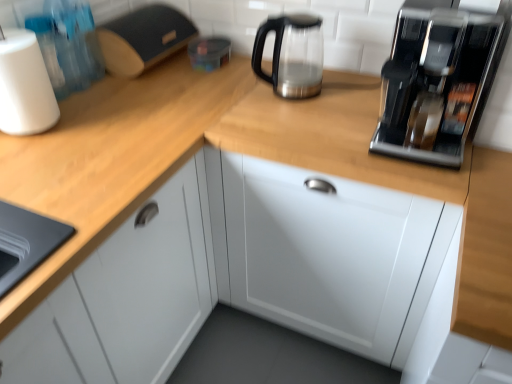
Image resolution: width=512 pixels, height=384 pixels. I want to click on matte black bread bin at upper left, so click(x=143, y=38).

This screenshot has width=512, height=384. I want to click on wooden at left, so click(x=110, y=159).

This screenshot has width=512, height=384. I want to click on white glossy cabinet at center, so click(336, 258).

In order to face white matte paper towel at left, should I rotate leftwards or rightwards?

Turn left by 29.865 degrees to look at white matte paper towel at left.

The width and height of the screenshot is (512, 384). In order to click on sleek metallic coffee machine at upper right in this screenshot , I will do click(438, 79).

From a real-world perspective, who is located higher, satin metallic kettle at upper center or matte black bread bin at upper left?

From a 3D spatial view, satin metallic kettle at upper center is above.

How many degrees apart are the facing directions of satin metallic kettle at upper center and matte black bread bin at upper left?

There is a 88.2-degree angle between the facing directions of satin metallic kettle at upper center and matte black bread bin at upper left.

Is satin metallic kettle at upper center facing away from matte black bread bin at upper left?

satin metallic kettle at upper center does not have its back to matte black bread bin at upper left.

Looking at this image, is satin metallic kettle at upper center not within matte black bread bin at upper left?

Yes, satin metallic kettle at upper center is outside of matte black bread bin at upper left.

Identify the location of kitchen appliance behind the white glossy cabinet at center. (292, 55).

Is satin metallic kettle at upper center at the right side of white glossy cabinet at center?

No.

Does satin metallic kettle at upper center have a lesser width compared to white glossy cabinet at center?

Yes, satin metallic kettle at upper center is thinner than white glossy cabinet at center.

Is satin metallic kettle at upper center located outside white glossy cabinet at center?

That's correct, satin metallic kettle at upper center is outside of white glossy cabinet at center.

From the image's perspective, between satin metallic kettle at upper center and sleek metallic coffee machine at upper right, who is located below?

sleek metallic coffee machine at upper right appears lower in the image.

Measure the distance from satin metallic kettle at upper center to sleek metallic coffee machine at upper right.

17.31 inches.

Is there a large distance between satin metallic kettle at upper center and sleek metallic coffee machine at upper right?

No, satin metallic kettle at upper center is in close proximity to sleek metallic coffee machine at upper right.

Is point (284, 75) more distant than point (436, 133)?

Yes, point (284, 75) is farther from viewer.

From the image's perspective, which one is positioned higher, white matte paper towel at left or white glossy cabinet at center?

white matte paper towel at left, from the image's perspective.

Looking at this image, from their relative heights in the image, would you say white matte paper towel at left is taller or shorter than white glossy cabinet at center?

Considering their sizes, white matte paper towel at left has less height than white glossy cabinet at center.

Is white matte paper towel at left not near white glossy cabinet at center?

No, there isn't a large distance between white matte paper towel at left and white glossy cabinet at center.

How much distance is there between white matte paper towel at left and white glossy cabinet at center?

white matte paper towel at left and white glossy cabinet at center are 31.62 inches apart from each other.

Is white glossy cabinet at center wider or thinner than sleek metallic coffee machine at upper right?

Clearly, white glossy cabinet at center has more width compared to sleek metallic coffee machine at upper right.

From the image's perspective, who appears lower, white glossy cabinet at center or sleek metallic coffee machine at upper right?

white glossy cabinet at center.

In the scene shown: From a real-world perspective, who is located higher, white glossy cabinet at center or sleek metallic coffee machine at upper right?

sleek metallic coffee machine at upper right, from a real-world perspective.

Which is in front, white glossy cabinet at center or sleek metallic coffee machine at upper right?

sleek metallic coffee machine at upper right is more forward.

Considering the relative positions of matte black bread bin at upper left and white matte paper towel at left in the image provided, is matte black bread bin at upper left to the left or to the right of white matte paper towel at left?

Clearly, matte black bread bin at upper left is on the right of white matte paper towel at left in the image.

From a real-world perspective, between matte black bread bin at upper left and white matte paper towel at left, who is vertically lower?

matte black bread bin at upper left, from a real-world perspective.

Considering the relative positions of matte black bread bin at upper left and white matte paper towel at left in the image provided, is matte black bread bin at upper left in front of white matte paper towel at left?

That is False.

Is point (152, 51) in front of point (28, 101)?

No, (152, 51) is behind (28, 101).

How many degrees apart are the facing directions of sleek metallic coffee machine at upper right and matte black bread bin at upper left?

sleek metallic coffee machine at upper right and matte black bread bin at upper left are facing 88.2 degrees away from each other.

Considering the sizes of objects sleek metallic coffee machine at upper right and matte black bread bin at upper left in the image provided, who is shorter, sleek metallic coffee machine at upper right or matte black bread bin at upper left?

matte black bread bin at upper left is shorter.

Do you think sleek metallic coffee machine at upper right is within matte black bread bin at upper left, or outside of it?

sleek metallic coffee machine at upper right is located beyond the bounds of matte black bread bin at upper left.

Where is `appliance behind the satin metallic kettle at upper center`? This screenshot has width=512, height=384. appliance behind the satin metallic kettle at upper center is located at coordinates (143, 38).

The height and width of the screenshot is (384, 512). There is a white glossy cabinet at center. Find the location of `kitchen appliance above it (from a real-world perspective)`. kitchen appliance above it (from a real-world perspective) is located at coordinates (292, 55).

Looking at the image, which one is located closer to white matte paper towel at left, sleek metallic coffee machine at upper right or matte black bread bin at upper left?

matte black bread bin at upper left is positioned closer to the anchor white matte paper towel at left.

From the image, which object appears to be nearer to wooden at left, white matte paper towel at left or matte black bread bin at upper left?

Based on the image, white matte paper towel at left appears to be nearer to wooden at left.

Estimate the real-world distances between objects in this image. Which object is further from matte black bread bin at upper left, wooden at left or sleek metallic coffee machine at upper right?

sleek metallic coffee machine at upper right is further to matte black bread bin at upper left.

Looking at this image, considering their positions, is matte black bread bin at upper left positioned closer to wooden at left than satin metallic kettle at upper center?

Among the two, matte black bread bin at upper left is located nearer to wooden at left.

From the image, which object appears to be nearer to wooden at left, white glossy cabinet at center or white matte paper towel at left?

Based on the image, white matte paper towel at left appears to be nearer to wooden at left.

Considering their positions, is white matte paper towel at left positioned closer to wooden at left than sleek metallic coffee machine at upper right?

white matte paper towel at left is closer to wooden at left.

Considering their positions, is satin metallic kettle at upper center positioned closer to white glossy cabinet at center than wooden at left?

wooden at left lies closer to white glossy cabinet at center than the other object.

Estimate the real-world distances between objects in this image. Which object is further from white glossy cabinet at center, white matte paper towel at left or wooden at left?

Based on the image, white matte paper towel at left appears to be further to white glossy cabinet at center.

This screenshot has width=512, height=384. Identify the location of kitchen appliance between wooden at left and white glossy cabinet at center. (292, 55).

This screenshot has width=512, height=384. I want to click on paper towel between matte black bread bin at upper left and wooden at left in the up-down direction, so click(25, 86).

The width and height of the screenshot is (512, 384). What are the coordinates of `kitchen appliance between matte black bread bin at upper left and sleek metallic coffee machine at upper right from left to right` in the screenshot? It's located at (292, 55).

What are the coordinates of `appliance between white matte paper towel at left and white glossy cabinet at center` in the screenshot? It's located at (143, 38).